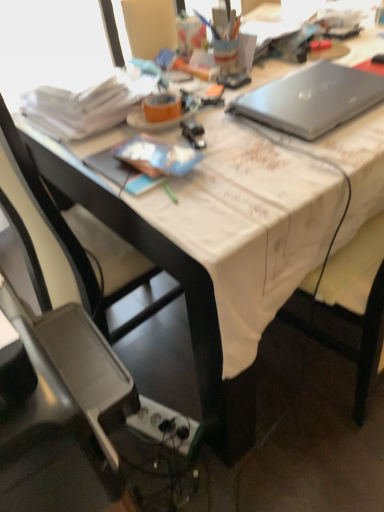
Locate an element on the screen. Image resolution: width=384 pixels, height=512 pixels. free space above white plastic power outlet at lower center (from a real-world perspective) is located at coordinates (160, 417).